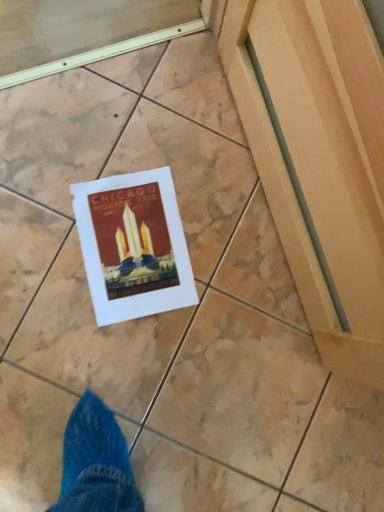
Image resolution: width=384 pixels, height=512 pixels. Identify the location of spots to the right of matte paper postcard at center. (221, 308).